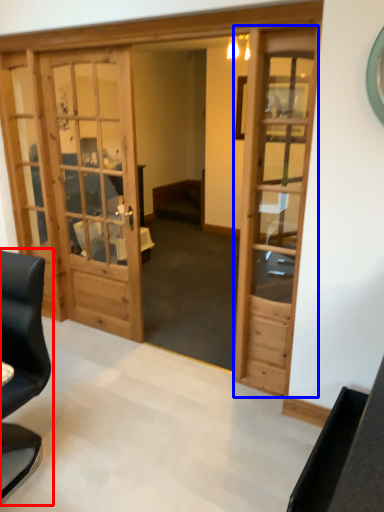
Question: Which object appears closest to the camera in this image, chair (highlighted by a red box) or door (highlighted by a blue box)?

Choices:
 (A) chair
 (B) door

Answer: (A)